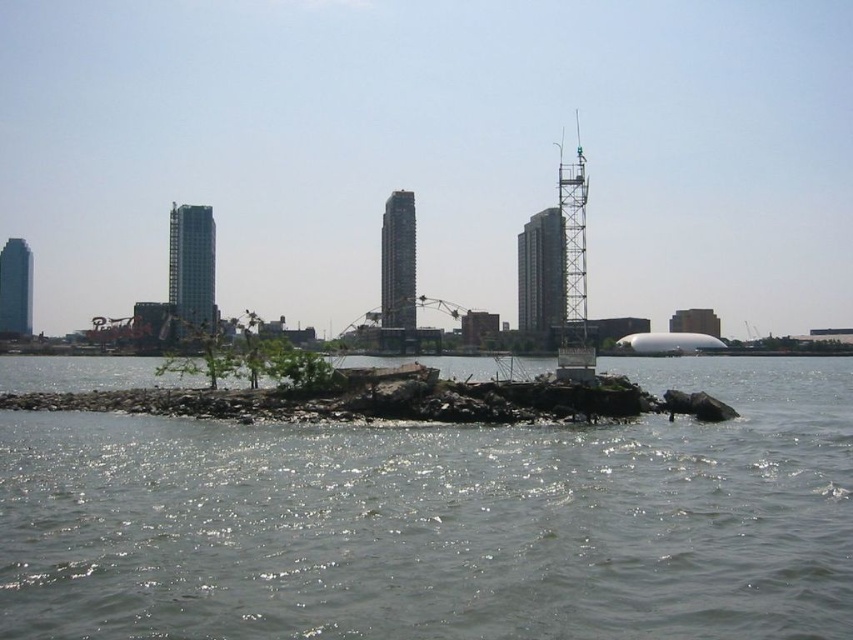
Is smooth concrete skyscraper at right taller than smooth glass skyscraper at center?

Result: No.

From the picture: Measure the distance from smooth concrete skyscraper at right to smooth glass skyscraper at center.

The distance of smooth concrete skyscraper at right from smooth glass skyscraper at center is 55.25 meters.

Describe the element at coordinates (540, 273) in the screenshot. I see `smooth concrete skyscraper at right` at that location.

The width and height of the screenshot is (853, 640). Find the location of `smooth concrete skyscraper at right`. smooth concrete skyscraper at right is located at coordinates (540, 273).

Who is more distant from viewer, (849, 588) or (575, 369)?

Positioned behind is point (575, 369).

Is point (144, 456) behind point (575, 339)?

No, it is not.

At what (x,y) coordinates should I click in order to perform the action: click on clear water at center. Please return your answer as a coordinate pair (x, y). Looking at the image, I should click on (442, 522).

Between clear water at center and silver glass skyscraper at center-left, which one has more height?

silver glass skyscraper at center-left is taller.

Who is positioned more to the left, clear water at center or silver glass skyscraper at center-left?

silver glass skyscraper at center-left is more to the left.

Between point (15, 512) and point (206, 308), which one is positioned in front?

Positioned in front is point (15, 512).

The width and height of the screenshot is (853, 640). I want to click on clear water at center, so click(x=442, y=522).